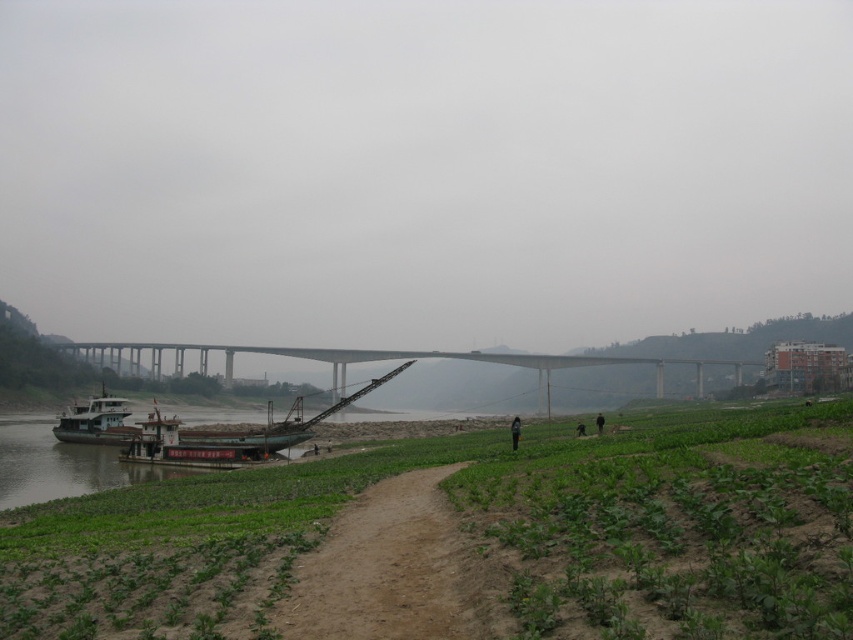
You are standing on the dirt path and want to take a photo of the white matte boat at left without any obstructions. Are the green leafy plants at lower left blocking your view of the boat?

The green leafy plants at lower left are in front of the white matte boat at left, so they are blocking the view of the boat. Move to a position where the plants are not between you and the boat to take an unobstructed photo.

You are a farmer standing on the dirt path and need to cross to the other side of the river. The white matte boat at left is available for use. Considering the width of the river and the size of the green leafy plants at lower left, can the boat fit between them?

The green leafy plants at lower left are wider than the white matte boat at left, so the boat should fit between them as there is enough space.